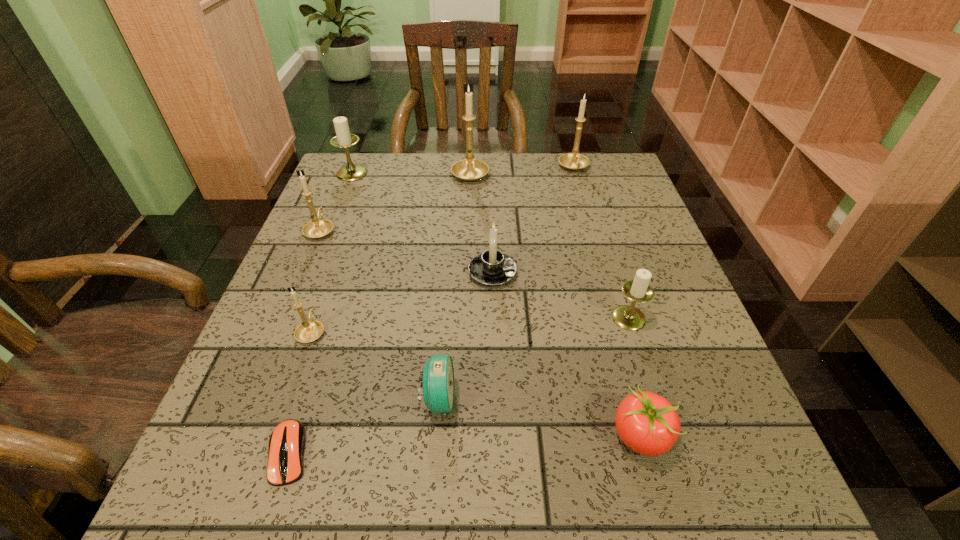
At what (x,y) coordinates should I click in order to perform the action: click on free location that satisfies the following two spatial constraints: 1. with a handle on the side of the fifth farthest object; 2. on the front side of the orange computer mouse. Please return your answer as a coordinate pair (x, y). This screenshot has width=960, height=540. Looking at the image, I should click on (498, 453).

What are the coordinates of `vacant space that satisfies the following two spatial constraints: 1. on the handle side of the ninth shortest object; 2. on the front-facing side of the blue alarm clock` in the screenshot? It's located at (642, 400).